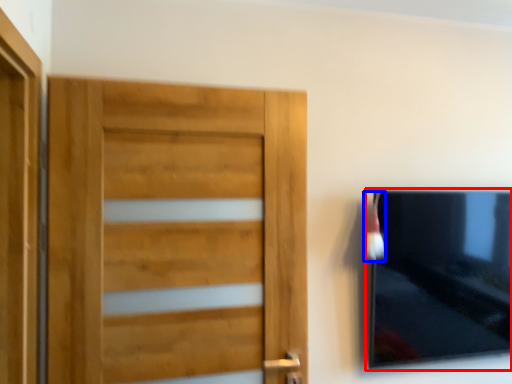
Question: Which point is further to the camera, picture frame (highlighted by a red box) or brush (highlighted by a blue box)?

Choices:
 (A) picture frame
 (B) brush

Answer: (A)